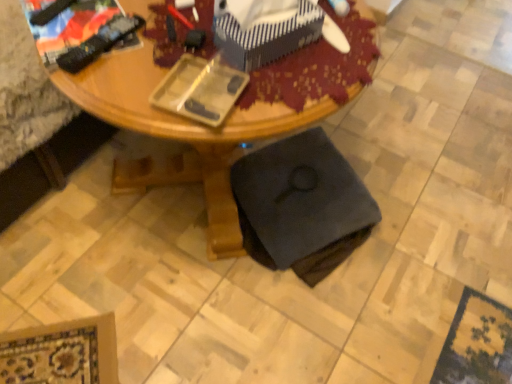
Question: Does point (296, 241) appear closer or farther from the camera than point (245, 16)?

Choices:
 (A) closer
 (B) farther

Answer: (B)

Question: From a real-world perspective, is black fabric swivel chair at lower center above or below blue striped fabric box at upper center?

Choices:
 (A) below
 (B) above

Answer: (A)

Question: Which is farther from the wooden desk at center?

Choices:
 (A) black fabric swivel chair at lower center
 (B) blue striped fabric box at upper center

Answer: (B)

Question: Estimate the real-world distances between objects in this image. Which object is farther from the black fabric swivel chair at lower center?

Choices:
 (A) blue striped fabric box at upper center
 (B) wooden desk at center

Answer: (A)